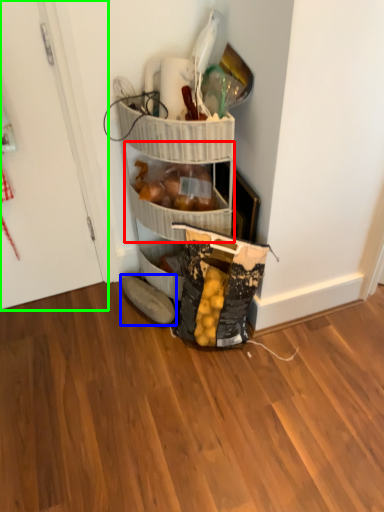
Question: Which object is the farthest from basket (highlighted by a red box)? Choose among these: footwear (highlighted by a blue box) or door (highlighted by a green box).

Choices:
 (A) footwear
 (B) door

Answer: (B)